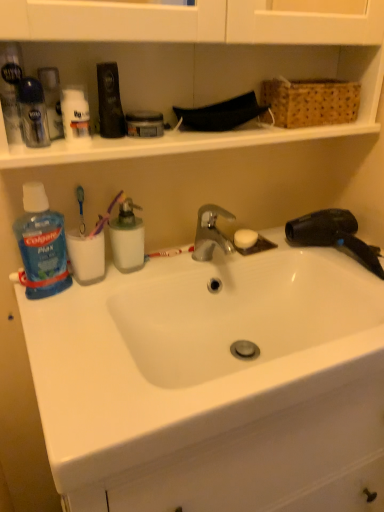
Where is `vacant space in front of white plastic toothbrush at center`? Image resolution: width=384 pixels, height=512 pixels. vacant space in front of white plastic toothbrush at center is located at coordinates (152, 282).